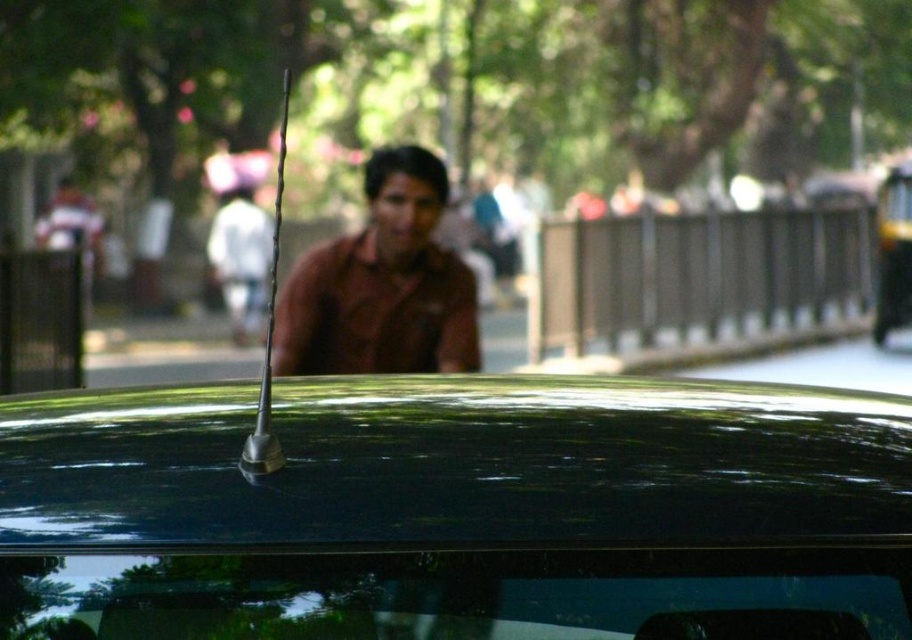
Does glossy metallic antenna at center have a greater width compared to brown matte shirt at center?

Result: Correct, the width of glossy metallic antenna at center exceeds that of brown matte shirt at center.

This screenshot has height=640, width=912. Describe the element at coordinates (452, 508) in the screenshot. I see `glossy metallic antenna at center` at that location.

I want to click on glossy metallic antenna at center, so click(x=452, y=508).